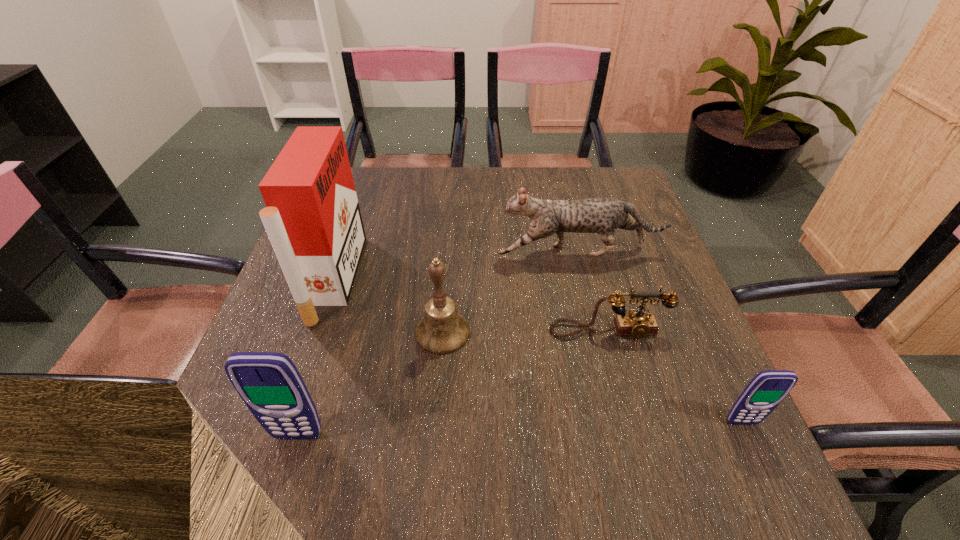
This screenshot has height=540, width=960. What are the coordinates of `object that is at the near right corner` in the screenshot? It's located at (767, 389).

Where is `vacant area at the far edge`? This screenshot has height=540, width=960. vacant area at the far edge is located at coordinates (507, 187).

I want to click on free space at the near edge of the desktop, so click(648, 428).

At what (x,y) coordinates should I click in order to perform the action: click on free spot at the right edge of the desktop. Please return your answer as a coordinate pair (x, y). The height and width of the screenshot is (540, 960). Looking at the image, I should click on (658, 271).

What are the coordinates of `vacant region at the near left corner of the desktop` in the screenshot? It's located at (227, 424).

Where is `blank area at the far right corner`? Image resolution: width=960 pixels, height=540 pixels. blank area at the far right corner is located at coordinates (589, 196).

Where is `free point between the tallest object and the taller cellular telephone`? free point between the tallest object and the taller cellular telephone is located at coordinates (317, 357).

I want to click on unoccupied position between the cigarette case and the third object from left to right, so click(389, 306).

Locate an element on the screen. The height and width of the screenshot is (540, 960). free spot between the fourth object from right to left and the nearest object is located at coordinates (371, 384).

Find the location of a particular element. unoccupied position between the telephone and the nearer cellular telephone is located at coordinates (453, 383).